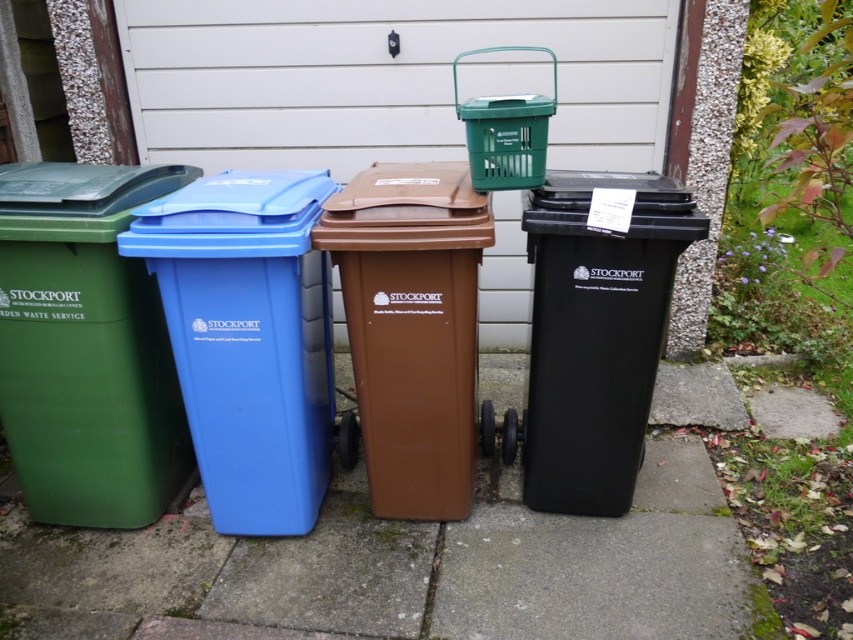
Describe the element at coordinates (248, 339) in the screenshot. The height and width of the screenshot is (640, 853). I see `blue plastic recycling bin at left` at that location.

Does blue plastic recycling bin at left appear on the left side of black plastic recycling bin at right?

Correct, you'll find blue plastic recycling bin at left to the left of black plastic recycling bin at right.

Image resolution: width=853 pixels, height=640 pixels. What are the coordinates of `blue plastic recycling bin at left` in the screenshot? It's located at (248, 339).

Does green concrete pavement at lower center appear on the left side of blue plastic recycling bin at left?

Incorrect, green concrete pavement at lower center is not on the left side of blue plastic recycling bin at left.

Does green concrete pavement at lower center appear on the right side of blue plastic recycling bin at left?

Yes, green concrete pavement at lower center is to the right of blue plastic recycling bin at left.

Where is `green concrete pavement at lower center`? This screenshot has height=640, width=853. green concrete pavement at lower center is located at coordinates (404, 568).

Locate an element on the screen. Image resolution: width=853 pixels, height=640 pixels. green concrete pavement at lower center is located at coordinates (404, 568).

Is green concrete pavement at lower center above green plastic recycling bin at left?

Incorrect, green concrete pavement at lower center is not positioned above green plastic recycling bin at left.

Between point (384, 602) and point (148, 422), which one is positioned behind?

Point (148, 422)

In order to click on green concrete pavement at lower center in this screenshot , I will do `click(404, 568)`.